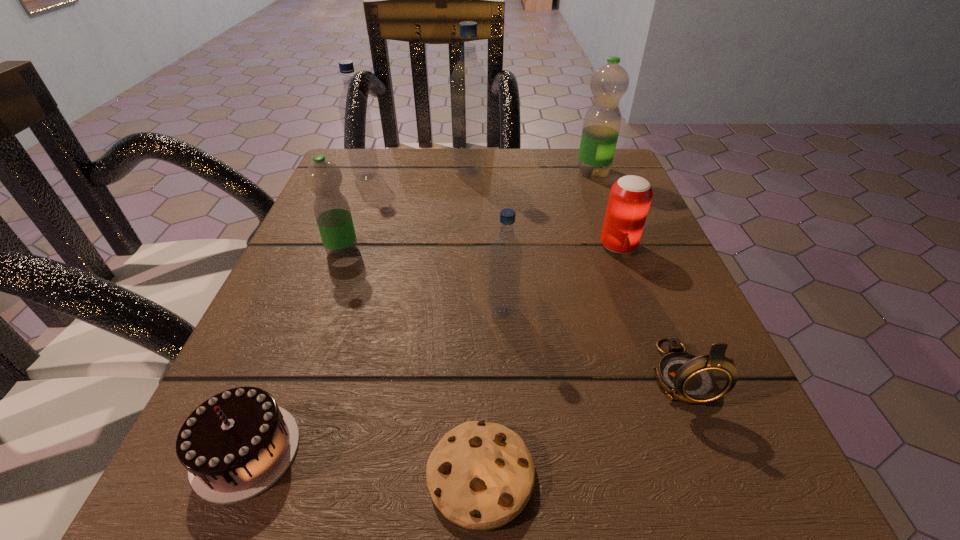
At what (x,y) coordinates should I click in order to perform the action: click on the tallest water bottle. Please return your answer as a coordinate pair (x, y). The height and width of the screenshot is (540, 960). Looking at the image, I should click on (469, 83).

This screenshot has height=540, width=960. I want to click on the biggest blue water bottle, so click(x=469, y=83).

You are a GUI agent. You are given a task and a screenshot of the screen. Output one action in this format:
    pyautogui.click(x=<x>, y=<y>)
    Task: Click on the farther green water bottle
    This screenshot has width=960, height=540.
    Given the screenshot: What is the action you would take?
    pyautogui.click(x=608, y=84)

The height and width of the screenshot is (540, 960). Find the location of `the rightmost water bottle`. the rightmost water bottle is located at coordinates (608, 84).

Image resolution: width=960 pixels, height=540 pixels. What are the coordinates of `the leftmost blue water bottle` in the screenshot? It's located at (353, 106).

Find the location of `the nearest water bottle`. the nearest water bottle is located at coordinates tap(505, 254).

Find the location of a particular element. the nearest blue water bottle is located at coordinates (505, 254).

The width and height of the screenshot is (960, 540). In order to click on the smaller green water bottle in this screenshot , I will do pos(332,212).

Locate an element on the screen. the fourth farthest water bottle is located at coordinates (332, 212).

Identify the location of beer can. The width and height of the screenshot is (960, 540). (630, 197).